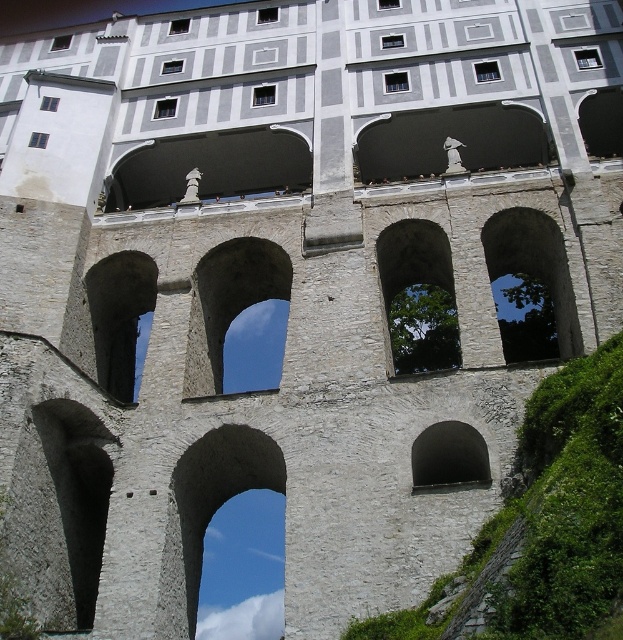
In the scene shown: You are an architect designing a new building that needs to incorporate two types of archways. You have a limited space of 3 meters between two pillars. The smooth stone archway at center and the black stone archway at center must both fit within this space. Based on the image, which archway should be placed closer to the left pillar to ensure both fit?

The smooth stone archway at center is wider than the black stone archway at center. To fit both within the 3 meters, place the wider smooth stone archway at center closer to the left pillar and the narrower black stone archway at center next to it. This arrangement ensures they both fit within the available space.